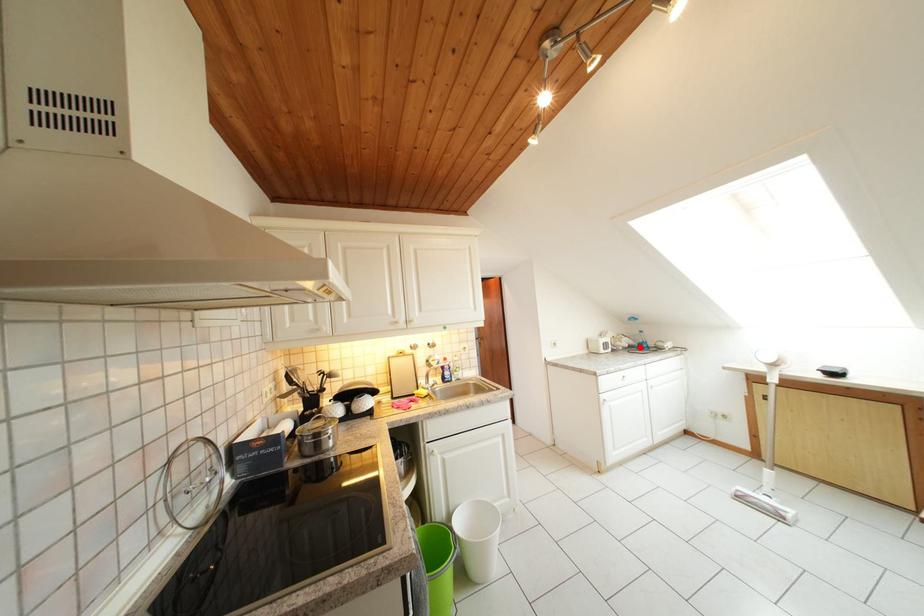
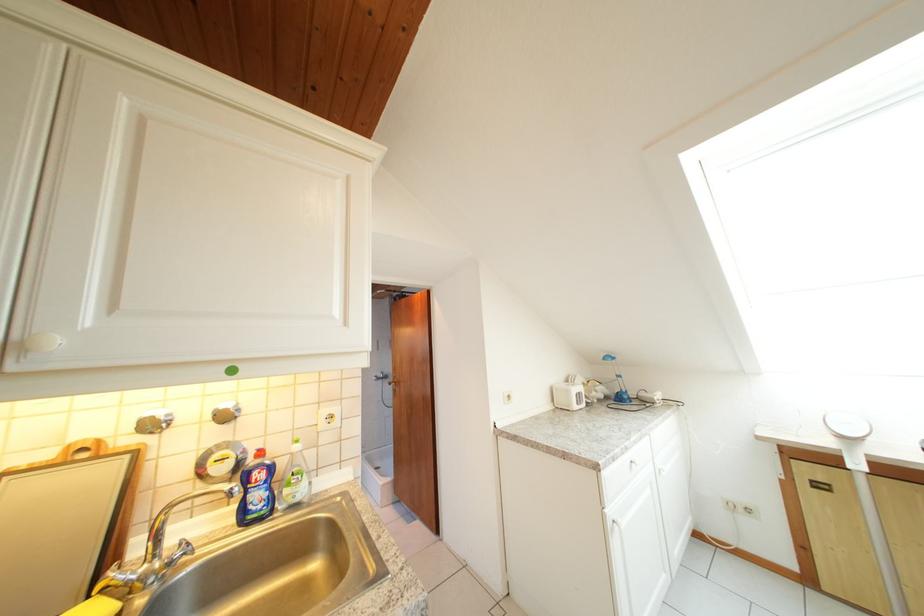
Question: I am providing you with two images of the same scene from different viewpoints. A red point is marked on the first image. Can you still see the location of the red point in image 2?

Choices:
 (A) Yes
 (B) No

Answer: (A)